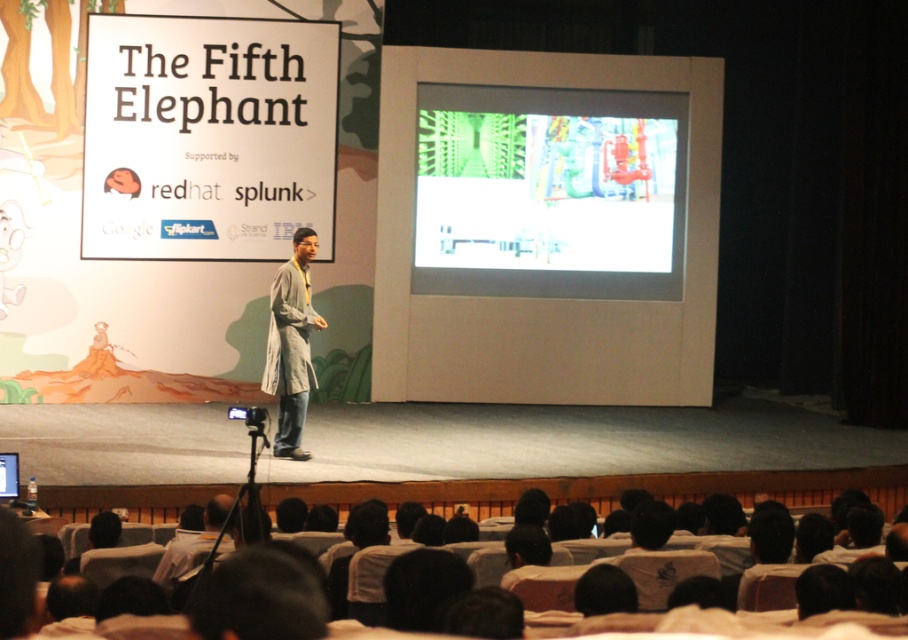
Consider the image. Is white glossy projection screen at center to the right of matte white screen at center from the viewer's perspective?

Indeed, white glossy projection screen at center is positioned on the right side of matte white screen at center.

Locate an element on the screen. The image size is (908, 640). white glossy projection screen at center is located at coordinates (549, 192).

Is gray fabric coat at center above matte white screen at center?

Correct, gray fabric coat at center is located above matte white screen at center.

Is gray fabric coat at center behind matte white screen at center?

Yes, gray fabric coat at center is behind matte white screen at center.

Which is in front, point (304, 268) or point (1, 470)?

Positioned in front is point (1, 470).

The width and height of the screenshot is (908, 640). In order to click on gray fabric coat at center in this screenshot , I will do `click(291, 344)`.

Between point (237, 161) and point (440, 246), which one is positioned behind?

The point (440, 246) is more distant.

The image size is (908, 640). What do you see at coordinates (206, 136) in the screenshot? I see `white paper at upper left` at bounding box center [206, 136].

This screenshot has width=908, height=640. What do you see at coordinates (206, 136) in the screenshot? I see `white paper at upper left` at bounding box center [206, 136].

Where is `white paper at upper left`? The height and width of the screenshot is (640, 908). white paper at upper left is located at coordinates (206, 136).